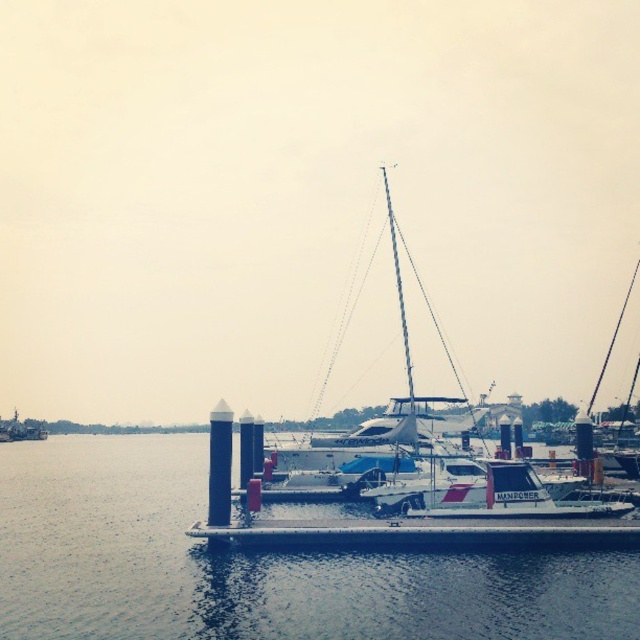
Question: Is clear water at center closer to the viewer compared to metallic gray boat at lower left?

Choices:
 (A) no
 (B) yes

Answer: (B)

Question: Which object appears closest to the camera in this image?

Choices:
 (A) metallic gray boat at lower left
 (B) clear water at center

Answer: (B)

Question: Which point is closer to the camera?

Choices:
 (A) (140, 525)
 (B) (17, 420)

Answer: (A)

Question: Can you confirm if clear water at center is bigger than metallic gray boat at lower left?

Choices:
 (A) no
 (B) yes

Answer: (B)

Question: Which object appears farthest from the camera in this image?

Choices:
 (A) metallic gray boat at lower left
 (B) clear water at center

Answer: (A)

Question: Is clear water at center further to camera compared to metallic gray boat at lower left?

Choices:
 (A) no
 (B) yes

Answer: (A)